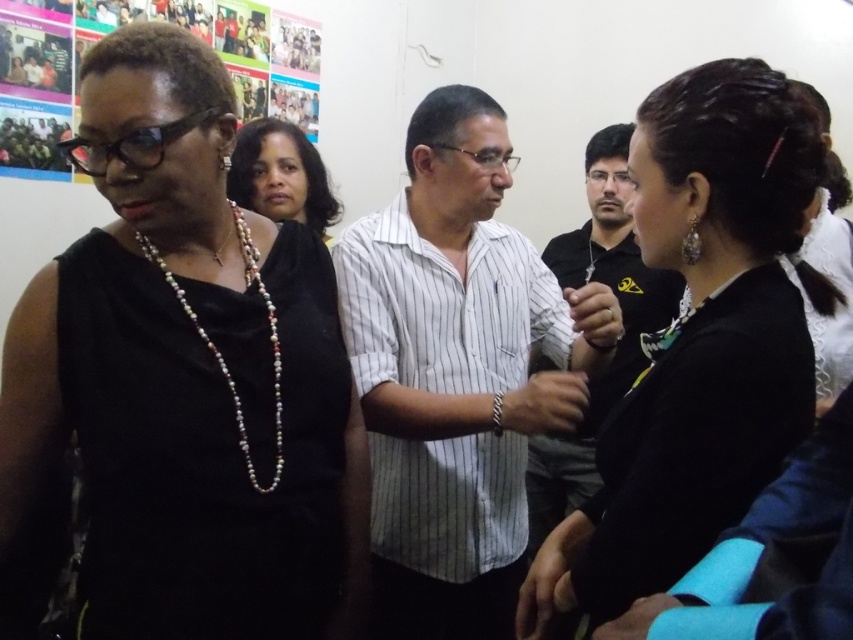
Is point (152, 42) positioned before point (260, 284)?

Yes, point (152, 42) is closer to viewer.

Which is in front, point (142, 561) or point (247, 280)?

Positioned in front is point (142, 561).

I want to click on black matte dress at left, so [189, 376].

Can you confirm if black matte dress at left is taller than black striped shirt at center?

Incorrect, black matte dress at left's height is not larger of black striped shirt at center's.

Can you confirm if black matte dress at left is positioned below black striped shirt at center?

Yes.

Where is `black matte dress at left`? black matte dress at left is located at coordinates (189, 376).

Which is behind, point (679, 513) or point (250, 483)?

Point (250, 483)

Is black fabric hair at center wider than pearl beaded necklace at center?

Yes.

Which is in front, point (801, 147) or point (247, 282)?

Positioned in front is point (801, 147).

Identify the location of black fabric hair at center. This screenshot has width=853, height=640. (697, 342).